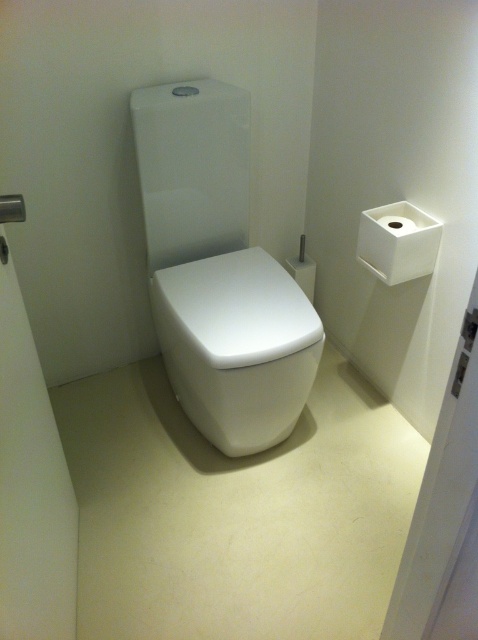
You are designing a bathroom layout and need to place a decorative plant between the white matte tissue at right and the white matte toilet paper at upper right. Which object should the plant be closer to if it needs to be placed closer to the wider object?

The white matte tissue at right might be wider than white matte toilet paper at upper right, so the plant should be placed closer to the white matte tissue at right.

You are standing in the bathroom and want to take a photo of the white glossy toilet bowl at center with your phone. If your phone has a 50mm lens, will you need to step back or move closer to frame the toilet bowl properly?

The white glossy toilet bowl at center and camera are 4.41 feet apart from each other. With a 50mm lens, a typical focal length for framing a toilet bowl at that distance would require you to be about 4.41 feet away. Since the distance matches the lens focal length, you don not need to adjust your position further.

You are designing a bathroom layout and need to ensure that the white glossy toilet bowl at center and the white matte toilet paper at upper right are spaced appropriately. Given that the toilet bowl is larger, where should you place the toilet paper holder to maintain balance?

Since the white glossy toilet bowl at center is bigger than the white matte toilet paper at upper right, placing the toilet paper holder closer to the toilet bowl would help balance the visual weight between the two objects.